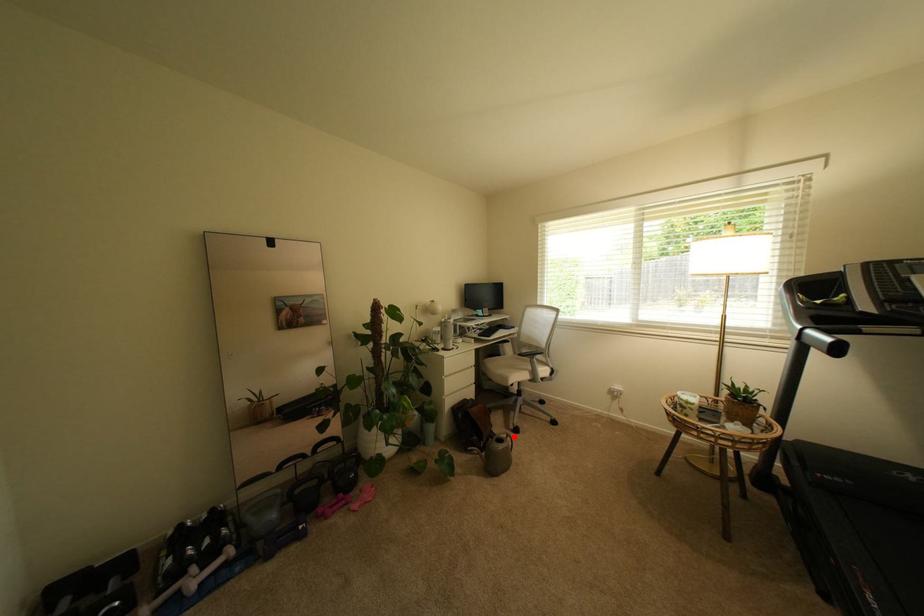
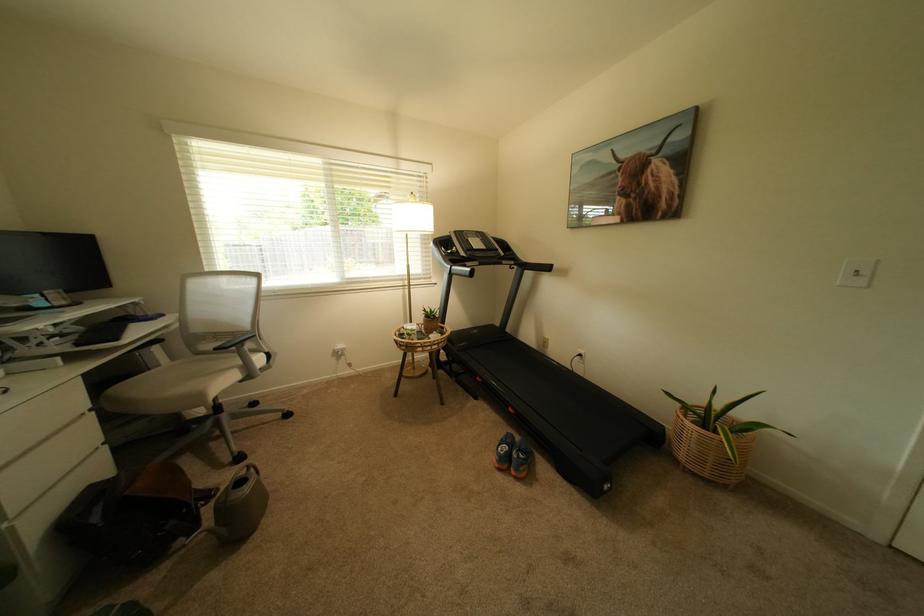
Question: I am providing you with two images of the same scene from different viewpoints. In image1, a red point is highlighted. Considering the same 3D point in image2, which of the following is correct?

Choices:
 (A) It is closer
 (B) It is farther

Answer: (B)